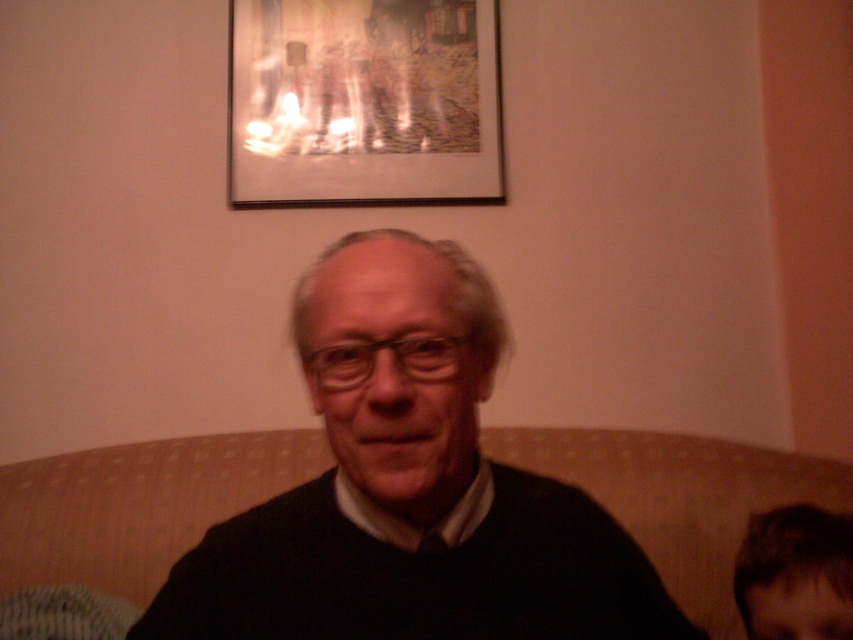
You are a photographer adjusting your camera settings to focus on the black matte sweater at center and the beige fabric couch at center. Which object should you focus on first to ensure proper depth of field?

The black matte sweater at center is closer to the viewer than the beige fabric couch at center, so you should focus on the black matte sweater at center first to ensure proper depth of field.